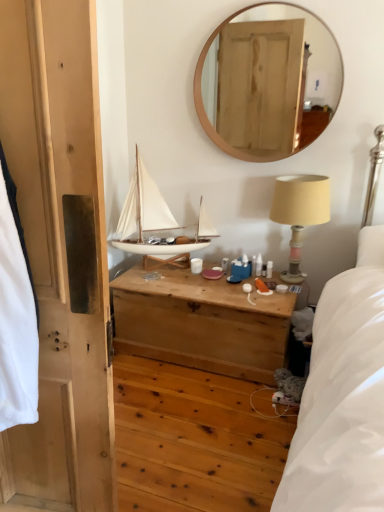
In order to click on wooden chest at center in this screenshot , I will do `click(201, 323)`.

Describe the element at coordinates (267, 81) in the screenshot. I see `wooden mirror at upper center` at that location.

The width and height of the screenshot is (384, 512). Describe the element at coordinates (300, 211) in the screenshot. I see `beige fabric-covered lampshade at upper right` at that location.

Locate an element on the screen. wooden door at left is located at coordinates (60, 248).

Identify the location of wooden chest at center. (201, 323).

Does wooden mirror at upper center have a lesser width compared to wooden chest at center?

Yes.

Does wooden mirror at upper center turn towards wooden chest at center?

No, wooden mirror at upper center does not turn towards wooden chest at center.

From a real-world perspective, is wooden mirror at upper center positioned under wooden chest at center based on gravity?

No, from a real-world perspective, wooden mirror at upper center is not under wooden chest at center.

Does wooden mirror at upper center appear on the right side of wooden chest at center?

Indeed, wooden mirror at upper center is positioned on the right side of wooden chest at center.

Visually, is wooden chest at center positioned to the left or to the right of wooden door at left?

Clearly, wooden chest at center is on the right of wooden door at left in the image.

Are wooden chest at center and wooden door at left beside each other?

No, wooden chest at center is not touching wooden door at left.

Is point (283, 328) closer or farther from the camera than point (70, 195)?

Point (283, 328).

Considering the relative sizes of wooden chest at center and wooden door at left in the image provided, is wooden chest at center thinner than wooden door at left?

No.

The image size is (384, 512). Identify the location of boat located on the left of wooden mirror at upper center. (144, 215).

From the image's perspective, would you say white matte sailboat at center is shown under wooden mirror at upper center?

Correct, white matte sailboat at center appears lower than wooden mirror at upper center in the image.

Is point (130, 212) farther from camera compared to point (200, 59)?

Yes, point (130, 212) is farther from viewer.

Between beige fabric-covered lampshade at upper right and white matte sailboat at center, which one has larger width?

white matte sailboat at center is wider.

From the image's perspective, is beige fabric-covered lampshade at upper right on white matte sailboat at center?

No, from the image's perspective, beige fabric-covered lampshade at upper right is not on top of white matte sailboat at center.

Does beige fabric-covered lampshade at upper right have a smaller size compared to white matte sailboat at center?

Yes.

Is beige fabric-covered lampshade at upper right shorter than white matte sailboat at center?

Yes.

In terms of width, does wooden mirror at upper center look wider or thinner when compared to white matte sailboat at center?

In the image, wooden mirror at upper center appears to be more narrow than white matte sailboat at center.

From a real-world perspective, which object stands above the other?

wooden mirror at upper center is physically above.

Is wooden mirror at upper center bigger or smaller than white matte sailboat at center?

Considering their sizes, wooden mirror at upper center takes up less space than white matte sailboat at center.

From a real-world perspective, who is located higher, wooden door at left or beige fabric-covered lampshade at upper right?

In real-world perspective, wooden door at left is above.

Is point (3, 72) less distant than point (307, 207)?

Yes, point (3, 72) is closer to viewer.

Considering the sizes of wooden door at left and beige fabric-covered lampshade at upper right in the image, is wooden door at left taller or shorter than beige fabric-covered lampshade at upper right?

wooden door at left is taller than beige fabric-covered lampshade at upper right.

From the image's perspective, is wooden door at left beneath beige fabric-covered lampshade at upper right?

Yes, from the image's perspective, wooden door at left is below beige fabric-covered lampshade at upper right.

You are a GUI agent. You are given a task and a screenshot of the screen. Output one action in this format:
    pyautogui.click(x=<x>, y=<y>)
    Task: Click on the door located on the left of wooden mirror at upper center
    The height and width of the screenshot is (512, 384).
    Given the screenshot: What is the action you would take?
    pyautogui.click(x=60, y=248)

Looking at this image, based on their positions, is wooden mirror at upper center located to the left or right of wooden door at left?

Based on their positions, wooden mirror at upper center is located to the right of wooden door at left.

Looking at this image, from a real-world perspective, is wooden mirror at upper center physically located above or below wooden door at left?

In terms of real-world spatial position, wooden mirror at upper center is above wooden door at left.

Which object is further away from the camera taking this photo, wooden mirror at upper center or wooden door at left?

Positioned behind is wooden mirror at upper center.

What are the coordinates of `vanity below the wooden mirror at upper center (from the image's perspective)` in the screenshot? It's located at (x=201, y=323).

In order to click on door above the wooden chest at center (from a real-world perspective) in this screenshot , I will do `click(60, 248)`.

Based on their spatial positions, is wooden chest at center or white matte sailboat at center closer to wooden mirror at upper center?

The object closer to wooden mirror at upper center is white matte sailboat at center.

Looking at the image, which one is located closer to white matte sailboat at center, wooden door at left or wooden chest at center?

wooden chest at center is closer to white matte sailboat at center.

Looking at the image, which one is located further to beige fabric-covered lampshade at upper right, wooden mirror at upper center or white matte sailboat at center?

wooden mirror at upper center is positioned further to the anchor beige fabric-covered lampshade at upper right.

In the scene shown: Which object lies nearer to the anchor point wooden door at left, wooden mirror at upper center or wooden chest at center?

wooden chest at center is closer to wooden door at left.

From the image, which object appears to be nearer to wooden door at left, wooden mirror at upper center or beige fabric-covered lampshade at upper right?

Among the two, beige fabric-covered lampshade at upper right is located nearer to wooden door at left.

Which object lies further to the anchor point white matte sailboat at center, wooden chest at center or beige fabric-covered lampshade at upper right?

beige fabric-covered lampshade at upper right is further to white matte sailboat at center.

Considering their positions, is white matte sailboat at center positioned closer to wooden door at left than beige fabric-covered lampshade at upper right?

white matte sailboat at center.

Based on their spatial positions, is wooden mirror at upper center or white matte sailboat at center closer to wooden chest at center?

Based on the image, white matte sailboat at center appears to be nearer to wooden chest at center.

Find the location of a particular element. vanity positioned between wooden door at left and white matte sailboat at center from near to far is located at coordinates (201, 323).

The image size is (384, 512). What are the coordinates of `mirror positioned between wooden door at left and wooden chest at center from near to far` in the screenshot? It's located at (267, 81).

In order to click on table lamp positioned between wooden door at left and white matte sailboat at center from near to far in this screenshot , I will do `click(300, 211)`.

Locate an element on the screen. boat between wooden mirror at upper center and beige fabric-covered lampshade at upper right in the vertical direction is located at coordinates (144, 215).